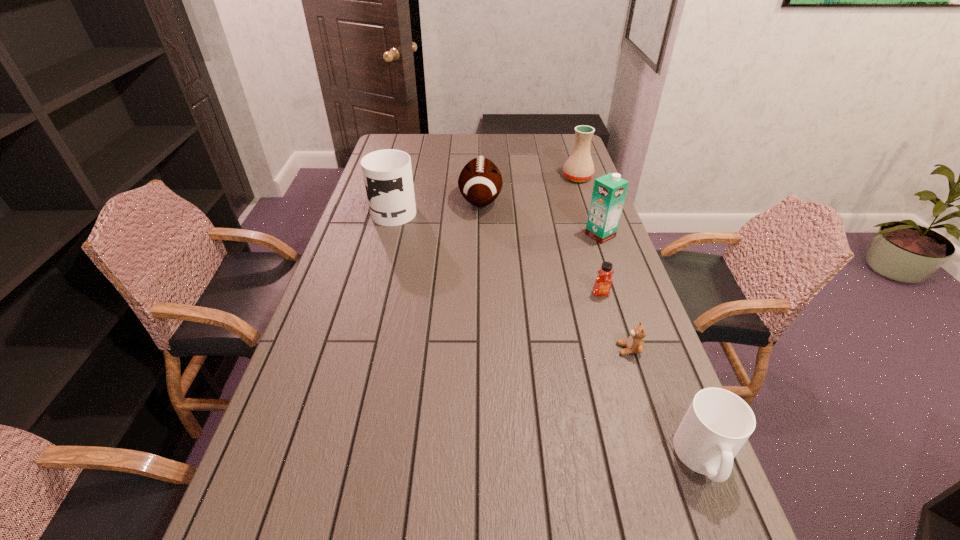
Where is `free space at the far edge of the desktop`? The image size is (960, 540). free space at the far edge of the desktop is located at coordinates (424, 156).

Where is `vacant area at the near edge of the desktop`? vacant area at the near edge of the desktop is located at coordinates (357, 483).

Identify the location of free space at the left edge of the desktop. The width and height of the screenshot is (960, 540). (344, 310).

Locate an element on the screen. The height and width of the screenshot is (540, 960). vacant space at the far right corner of the desktop is located at coordinates (567, 134).

Identify the location of free space between the leftmost object and the fourth tallest object. This screenshot has width=960, height=540. (438, 205).

At what (x,y) coordinates should I click in order to perform the action: click on empty space that is in between the carton and the leftmost object. Please return your answer as a coordinate pair (x, y). The image size is (960, 540). Looking at the image, I should click on (497, 222).

The image size is (960, 540). What are the coordinates of `blank region between the right mug and the fourth tallest object` in the screenshot? It's located at 592,330.

Locate an element on the screen. free space that is in between the fourth farthest object and the teddy bear is located at coordinates (614, 292).

Where is `free area in between the right mug and the carton`? free area in between the right mug and the carton is located at coordinates (652, 347).

Where is `free spot between the carton and the pottery`? free spot between the carton and the pottery is located at coordinates (588, 206).